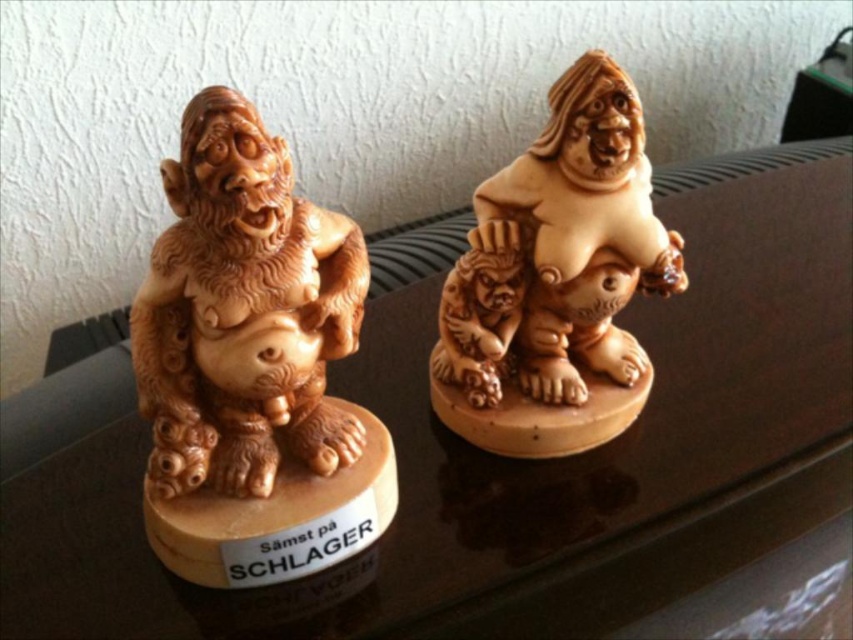
Question: Does wooden statue at left have a lesser width compared to matte wood statue at center?

Choices:
 (A) no
 (B) yes

Answer: (B)

Question: Among these points, which one is farthest from the camera?

Choices:
 (A) (199, 310)
 (B) (635, 276)

Answer: (B)

Question: Which point appears closest to the camera in this image?

Choices:
 (A) (650, 192)
 (B) (260, 384)

Answer: (B)

Question: Is wooden statue at left further to the viewer compared to matte wood statue at center?

Choices:
 (A) no
 (B) yes

Answer: (A)

Question: Can you confirm if wooden statue at left is positioned above matte wood statue at center?

Choices:
 (A) yes
 (B) no

Answer: (B)

Question: Which object appears closest to the camera in this image?

Choices:
 (A) wooden statue at left
 (B) matte wood statue at center

Answer: (A)